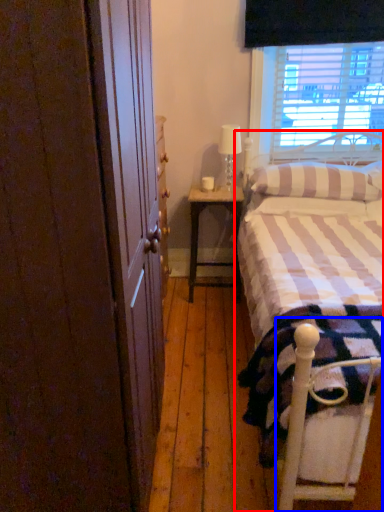
Question: Which of the following is the closest to the observer, bed (highlighted by a red box) or bed frame (highlighted by a blue box)?

Choices:
 (A) bed
 (B) bed frame

Answer: (A)